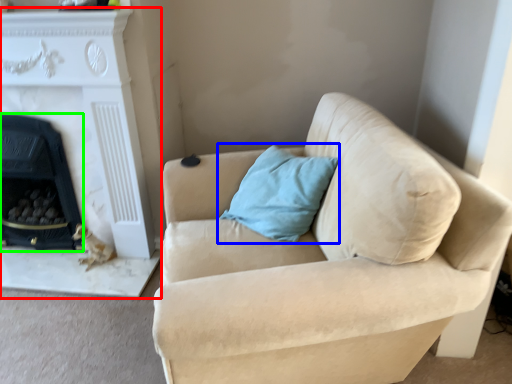
Question: Based on their relative distances, which object is farther from fireplace (highlighted by a red box)? Choose from pillow (highlighted by a blue box) and fireplace (highlighted by a green box).

Choices:
 (A) pillow
 (B) fireplace

Answer: (A)